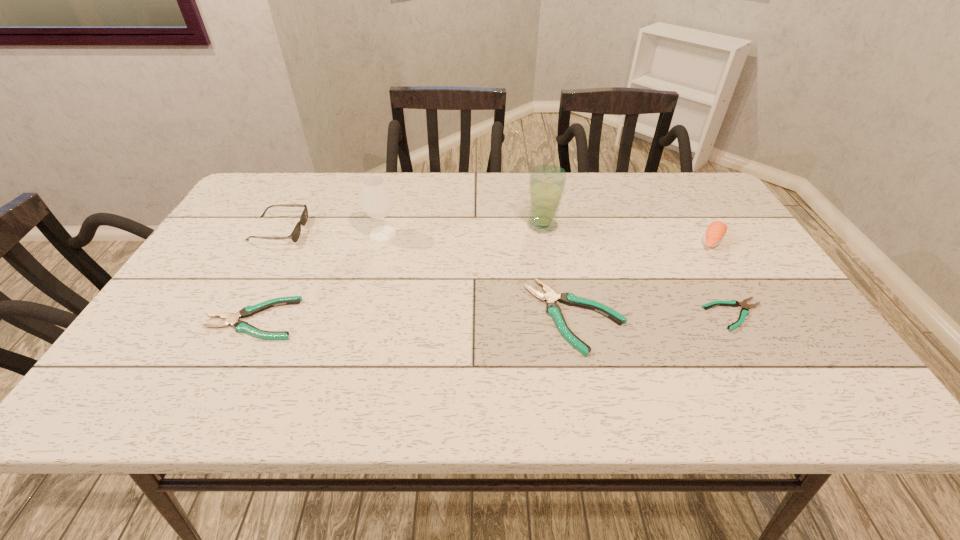
Locate which pliers is the closest to the second pliers from right to left. Please provide its 2D coordinates. Your answer should be formatted as a tuple, i.e. [(x, y)], where the tuple contains the x and y coordinates of a point satisfying the conditions above.

[(744, 312)]

Locate an element on the screen. This screenshot has height=540, width=960. vacant space that satisfies the following two spatial constraints: 1. on the front-facing side of the fourth tallest object; 2. on the back side of the left glass is located at coordinates pyautogui.click(x=277, y=234).

Locate an element on the screen. The width and height of the screenshot is (960, 540). free region that satisfies the following two spatial constraints: 1. on the back side of the second tallest pliers; 2. on the left side of the sushi is located at coordinates (292, 241).

What are the coordinates of `free space that satisfies the following two spatial constraints: 1. on the back side of the shortest object; 2. on the right side of the second pliers from left to right` in the screenshot? It's located at (575, 314).

Image resolution: width=960 pixels, height=540 pixels. I want to click on free point that satisfies the following two spatial constraints: 1. on the front side of the second pliers from right to left; 2. on the left side of the left glass, so click(362, 316).